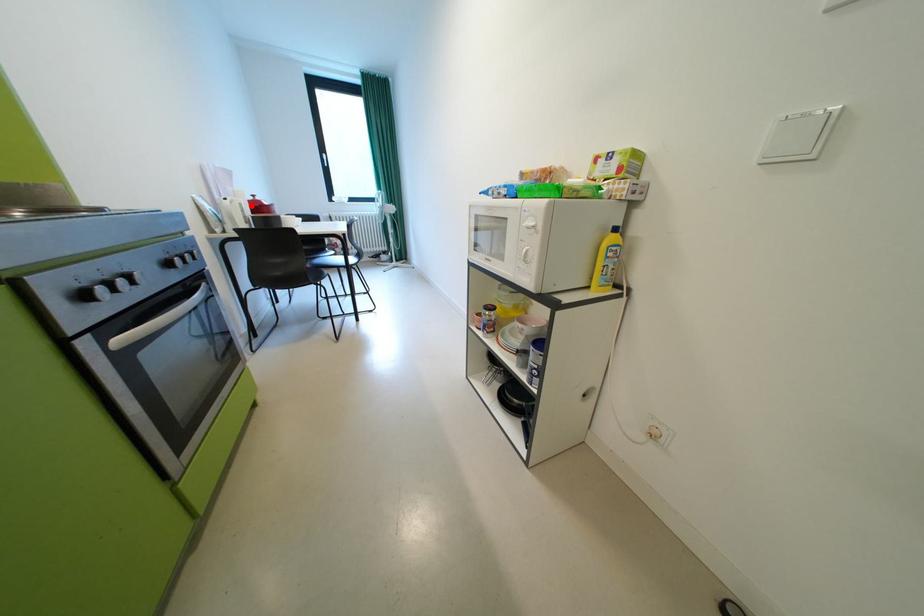
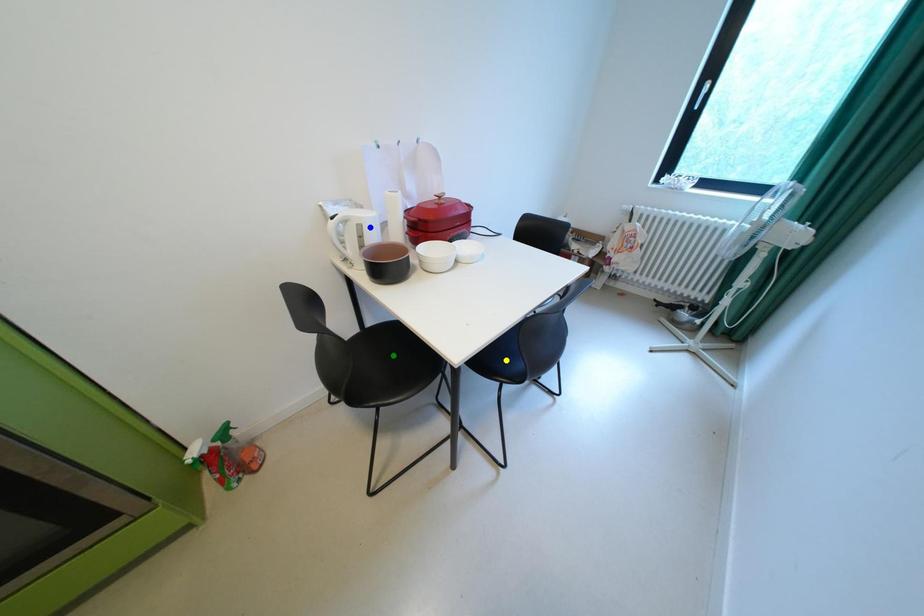
Question: I am providing you with two images of the same scene from different viewpoints. A red point is marked on the first image. You are given multiple points on the second image. Which point in image 2 is actually the same real-world point as the red point in image 1?

Choices:
 (A) green point
 (B) blue point
 (C) yellow point

Answer: (B)